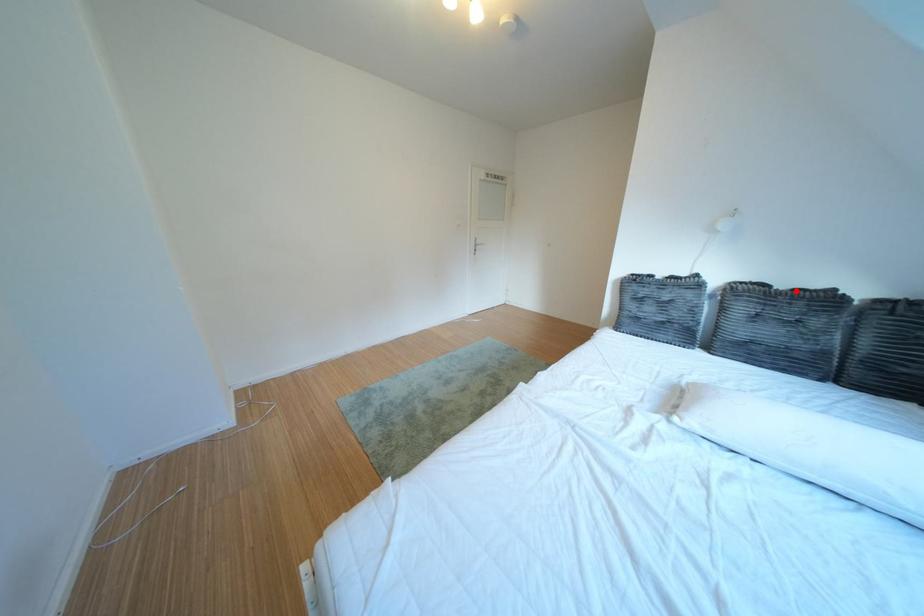
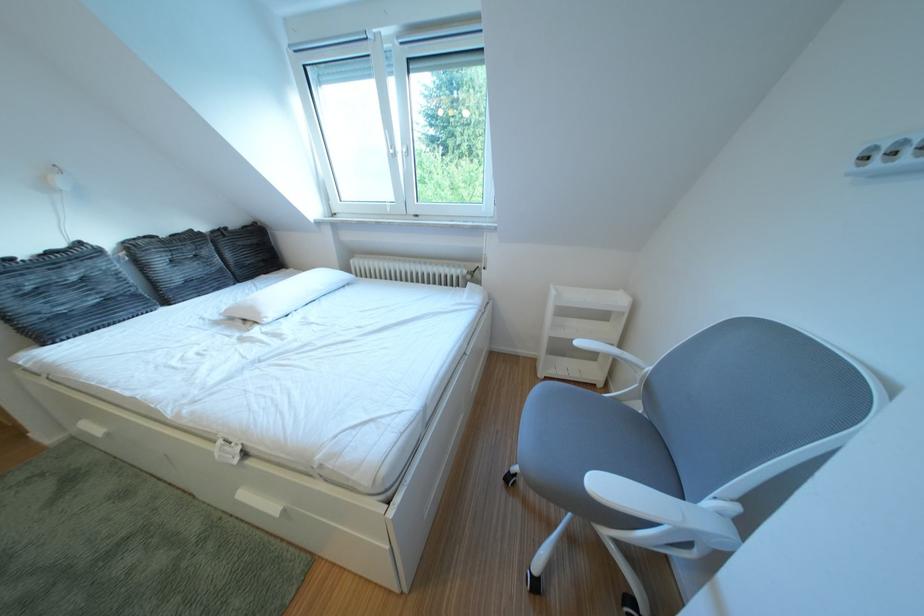
Find the pixel in the second image that matches the highlighted location in the first image.

(176, 240)